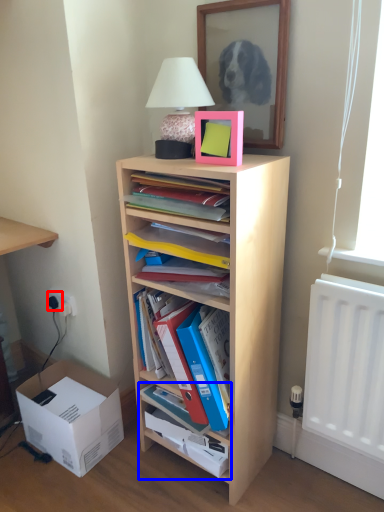
Question: Which point is further to the camera, electric outlet (highlighted by a red box) or cabinet (highlighted by a blue box)?

Choices:
 (A) electric outlet
 (B) cabinet

Answer: (A)